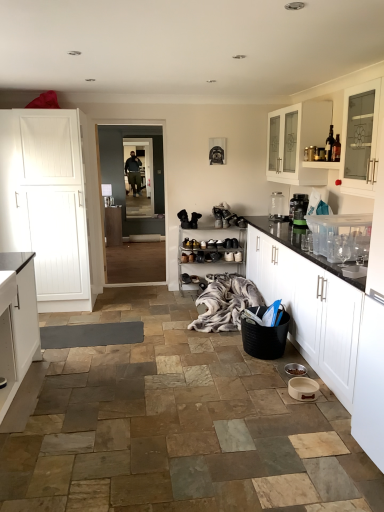
Question: Can you confirm if gray woolen blanket at lower center is positioned to the right of dark brown glass bottle at upper right?

Choices:
 (A) no
 (B) yes

Answer: (A)

Question: Considering the relative sizes of gray woolen blanket at lower center and dark brown glass bottle at upper right in the image provided, is gray woolen blanket at lower center thinner than dark brown glass bottle at upper right?

Choices:
 (A) no
 (B) yes

Answer: (A)

Question: Is gray woolen blanket at lower center aimed at dark brown glass bottle at upper right?

Choices:
 (A) no
 (B) yes

Answer: (A)

Question: Is gray woolen blanket at lower center further to the viewer compared to dark brown glass bottle at upper right?

Choices:
 (A) yes
 (B) no

Answer: (A)

Question: Is gray woolen blanket at lower center looking in the opposite direction of dark brown glass bottle at upper right?

Choices:
 (A) yes
 (B) no

Answer: (B)

Question: Is gray woolen blanket at lower center shorter than dark brown glass bottle at upper right?

Choices:
 (A) yes
 (B) no

Answer: (B)

Question: Does dark brown glass bottle at upper right have a larger size compared to gray woolen blanket at lower center?

Choices:
 (A) no
 (B) yes

Answer: (A)

Question: Does dark brown glass bottle at upper right have a lesser height compared to gray woolen blanket at lower center?

Choices:
 (A) yes
 (B) no

Answer: (A)

Question: Is dark brown glass bottle at upper right completely or partially outside of gray woolen blanket at lower center?

Choices:
 (A) yes
 (B) no

Answer: (A)

Question: Can you confirm if dark brown glass bottle at upper right is smaller than gray woolen blanket at lower center?

Choices:
 (A) yes
 (B) no

Answer: (A)

Question: Is dark brown glass bottle at upper right taller than gray woolen blanket at lower center?

Choices:
 (A) no
 (B) yes

Answer: (A)

Question: Is the depth of dark brown glass bottle at upper right less than that of gray woolen blanket at lower center?

Choices:
 (A) no
 (B) yes

Answer: (B)

Question: Is transparent glass water bottle at upper right facing away from leather shoe at center?

Choices:
 (A) no
 (B) yes

Answer: (A)